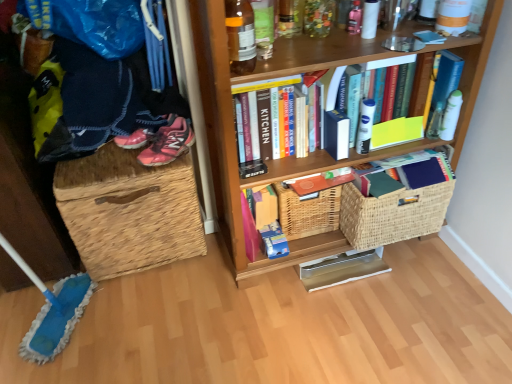
At what (x,y) coordinates should I click in order to perform the action: click on translucent glass bottle at upper center. Please return your answer as a coordinate pair (x, y). This screenshot has width=512, height=384. Looking at the image, I should click on (240, 36).

Locate an element on the screen. This screenshot has width=512, height=384. pink mesh sneakers at left is located at coordinates (166, 142).

Where is `woven brown basket at center, the second basket viewed from the right`? This screenshot has height=384, width=512. woven brown basket at center, the second basket viewed from the right is located at coordinates (308, 212).

The image size is (512, 384). What do you see at coordinates (342, 269) in the screenshot?
I see `metallic gold book at lower center, the first book from the bottom` at bounding box center [342, 269].

The width and height of the screenshot is (512, 384). Find the location of `woven wicker basket at right, positioned as the 1th basket in right-to-left order`. woven wicker basket at right, positioned as the 1th basket in right-to-left order is located at coordinates (392, 215).

Find the location of `hardcover books at upper center, which is counted as the 1th book, starting from the top`. hardcover books at upper center, which is counted as the 1th book, starting from the top is located at coordinates (330, 161).

Identify the location of pink matte book at center, the 2th book when ordered from top to bottom. (263, 224).

Which object is thinner, metallic gold book at lower center, the first book from the bottom, or woven wicker basket at right, marked as the second basket in a left-to-right arrangement?

Thinner between the two is metallic gold book at lower center, the first book from the bottom.

Consider the image. How different are the orientations of metallic gold book at lower center, positioned as the third book in top-to-bottom order, and woven wicker basket at right, marked as the second basket in a left-to-right arrangement, in degrees?

The angular difference between metallic gold book at lower center, positioned as the third book in top-to-bottom order, and woven wicker basket at right, marked as the second basket in a left-to-right arrangement, is 0.000205 degrees.

Which object is positioned more to the right, metallic gold book at lower center, positioned as the third book in top-to-bottom order, or woven wicker basket at right, positioned as the 1th basket in right-to-left order?

woven wicker basket at right, positioned as the 1th basket in right-to-left order, is more to the right.

Would you say metallic gold book at lower center, the first book from the bottom, contains woven wicker basket at right, marked as the second basket in a left-to-right arrangement?

No.

Which of these two, wooden bookcase at right or woven wicker basket at right, positioned as the 1th basket in right-to-left order, is wider?

wooden bookcase at right.

Is wooden bookcase at right with woven wicker basket at right, positioned as the 1th basket in right-to-left order?

No.

Which is behind, wooden bookcase at right or woven wicker basket at right, marked as the second basket in a left-to-right arrangement?

woven wicker basket at right, marked as the second basket in a left-to-right arrangement, is behind.

From a real-world perspective, which is physically below, wooden bookcase at right or woven wicker basket at right, positioned as the 1th basket in right-to-left order?

In real-world perspective, woven wicker basket at right, positioned as the 1th basket in right-to-left order, is lower.

From the image's perspective, is hardcover books at upper center, which ranks as the third book in bottom-to-top order, under dark blue knitted sweater at left?

Yes, from the image's perspective, hardcover books at upper center, which ranks as the third book in bottom-to-top order, is beneath dark blue knitted sweater at left.

Is point (318, 151) farther from viewer compared to point (93, 118)?

Yes, point (318, 151) is behind point (93, 118).

You are a GUI agent. You are given a task and a screenshot of the screen. Output one action in this format:
    pyautogui.click(x=<x>, y=<y>)
    Task: Click on the clothing behind the hardcover books at upper center, which ranks as the third book in bottom-to-top order
    This screenshot has width=512, height=384.
    Given the screenshot: What is the action you would take?
    pyautogui.click(x=93, y=101)

From the image's perspective, is translucent glass bottle at upper center positioned above or below woven wicker basket at right, positioned as the 1th basket in right-to-left order?

translucent glass bottle at upper center is situated higher than woven wicker basket at right, positioned as the 1th basket in right-to-left order, in the image.

Does translucent glass bottle at upper center have a greater width compared to woven wicker basket at right, positioned as the 1th basket in right-to-left order?

No.

Is translucent glass bottle at upper center to the left or to the right of woven wicker basket at right, positioned as the 1th basket in right-to-left order, in the image?

translucent glass bottle at upper center is to the left of woven wicker basket at right, positioned as the 1th basket in right-to-left order.

Based on their sizes in the image, would you say translucent glass bottle at upper center is bigger or smaller than woven wicker basket at right, positioned as the 1th basket in right-to-left order?

In the image, translucent glass bottle at upper center appears to be smaller than woven wicker basket at right, positioned as the 1th basket in right-to-left order.

Is dark blue knitted sweater at left inside woven wicker basket at right, marked as the second basket in a left-to-right arrangement?

No, dark blue knitted sweater at left is not inside woven wicker basket at right, marked as the second basket in a left-to-right arrangement.

Between woven wicker basket at right, marked as the second basket in a left-to-right arrangement, and dark blue knitted sweater at left, which one is positioned behind?

woven wicker basket at right, marked as the second basket in a left-to-right arrangement, is further away from the camera.

Looking at this image, from a real-world perspective, is woven wicker basket at right, marked as the second basket in a left-to-right arrangement, physically below dark blue knitted sweater at left?

Yes, from a real-world perspective, woven wicker basket at right, marked as the second basket in a left-to-right arrangement, is beneath dark blue knitted sweater at left.

From the picture: Could you tell me if woven wicker basket at right, positioned as the 1th basket in right-to-left order, is turned towards dark blue knitted sweater at left?

No, woven wicker basket at right, positioned as the 1th basket in right-to-left order, is not aimed at dark blue knitted sweater at left.

At what (x,y) coordinates should I click in order to perform the action: click on bottle in front of the woven straw laundry basket at left. Please return your answer as a coordinate pair (x, y). Looking at the image, I should click on (240, 36).

How different are the orientations of translucent glass bottle at upper center and woven straw laundry basket at left in degrees?

Answer: There is a 4.5-degree angle between the facing directions of translucent glass bottle at upper center and woven straw laundry basket at left.

Which point is more distant from viewer, (247, 4) or (72, 229)?

The point (72, 229) is more distant.

Which of these two, translucent glass bottle at upper center or woven straw laundry basket at left, stands taller?

With more height is woven straw laundry basket at left.

Is metallic gold book at lower center, the first book from the bottom, outside of woven straw laundry basket at left?

Yes, metallic gold book at lower center, the first book from the bottom, is located beyond the bounds of woven straw laundry basket at left.

From the image's perspective, which is above, metallic gold book at lower center, the first book from the bottom, or woven straw laundry basket at left?

woven straw laundry basket at left, from the image's perspective.

Find the location of a particular element. book that is under the woven wicker basket at right, positioned as the 1th basket in right-to-left order (from a real-world perspective) is located at coordinates (342, 269).

There is a woven wicker basket at right, marked as the second basket in a left-to-right arrangement. Where is `bookcase above it (from a real-world perspective)`? This screenshot has height=384, width=512. bookcase above it (from a real-world perspective) is located at coordinates (233, 126).

In the scene shown: From the image, which object appears to be nearer to dark blue knitted sweater at left, metallic gold book at lower center, the first book from the bottom, or woven brown basket at center, arranged as the 1th basket when viewed from the left?

woven brown basket at center, arranged as the 1th basket when viewed from the left, is closer to dark blue knitted sweater at left.

Looking at the image, which one is located further to hardcover books at upper center, which is counted as the 1th book, starting from the top, wooden bookcase at right or woven wicker basket at right, marked as the second basket in a left-to-right arrangement?

Among the two, woven wicker basket at right, marked as the second basket in a left-to-right arrangement, is located further to hardcover books at upper center, which is counted as the 1th book, starting from the top.

Looking at the image, which one is located further to translucent glass bottle at upper center, hardcover books at upper center, which ranks as the third book in bottom-to-top order, or pink mesh sneakers at left?

hardcover books at upper center, which ranks as the third book in bottom-to-top order, lies further to translucent glass bottle at upper center than the other object.

Estimate the real-world distances between objects in this image. Which object is closer to metallic gold book at lower center, the first book from the bottom, pink matte book at center, the 2th book when ordered from top to bottom, or woven straw laundry basket at left?

pink matte book at center, the 2th book when ordered from top to bottom, lies closer to metallic gold book at lower center, the first book from the bottom, than the other object.

When comparing their distances from pink matte book at center, the 2th book when ordered from top to bottom, does woven straw laundry basket at left or dark blue knitted sweater at left seem further?

dark blue knitted sweater at left lies further to pink matte book at center, the 2th book when ordered from top to bottom, than the other object.

From the image, which object appears to be nearer to metallic gold book at lower center, the first book from the bottom, dark blue knitted sweater at left or woven wicker basket at right, positioned as the 1th basket in right-to-left order?

woven wicker basket at right, positioned as the 1th basket in right-to-left order.

From the image, which object appears to be farther from dark blue knitted sweater at left, translucent glass bottle at upper center or pink mesh sneakers at left?

The object further to dark blue knitted sweater at left is translucent glass bottle at upper center.

Looking at the image, which one is located closer to dark blue knitted sweater at left, woven wicker basket at right, positioned as the 1th basket in right-to-left order, or translucent glass bottle at upper center?

The object closer to dark blue knitted sweater at left is translucent glass bottle at upper center.

You are a GUI agent. You are given a task and a screenshot of the screen. Output one action in this format:
    pyautogui.click(x=<x>, y=<y>)
    Task: Click on the bookcase between woven straw laundry basket at left and hardcover books at upper center, which ranks as the third book in bottom-to-top order, in the horizontal direction
    
    Given the screenshot: What is the action you would take?
    pyautogui.click(x=233, y=126)

At what (x,y) coordinates should I click in order to perform the action: click on footwear between translucent glass bottle at upper center and metallic gold book at lower center, the first book from the bottom, vertically. Please return your answer as a coordinate pair (x, y). This screenshot has width=512, height=384. Looking at the image, I should click on coord(166,142).

Locate an element on the screen. Image resolution: width=512 pixels, height=384 pixels. basket located between wooden bookcase at right and woven brown basket at center, the second basket viewed from the right, in the depth direction is located at coordinates (392, 215).

The width and height of the screenshot is (512, 384). In order to click on book positioned between wooden bookcase at right and pink matte book at center, the second book positioned from the bottom, from near to far in this screenshot , I will do `click(330, 161)`.